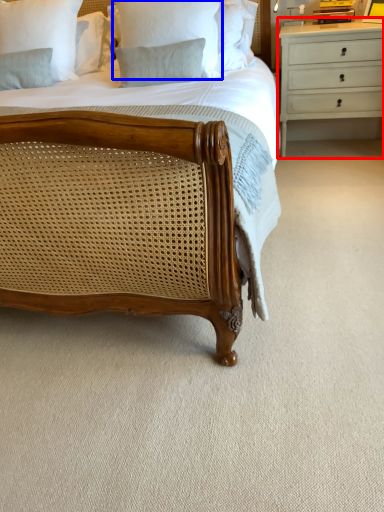
Question: Which point is further to the camera, chest of drawers (highlighted by a red box) or pillow (highlighted by a blue box)?

Choices:
 (A) chest of drawers
 (B) pillow

Answer: (A)